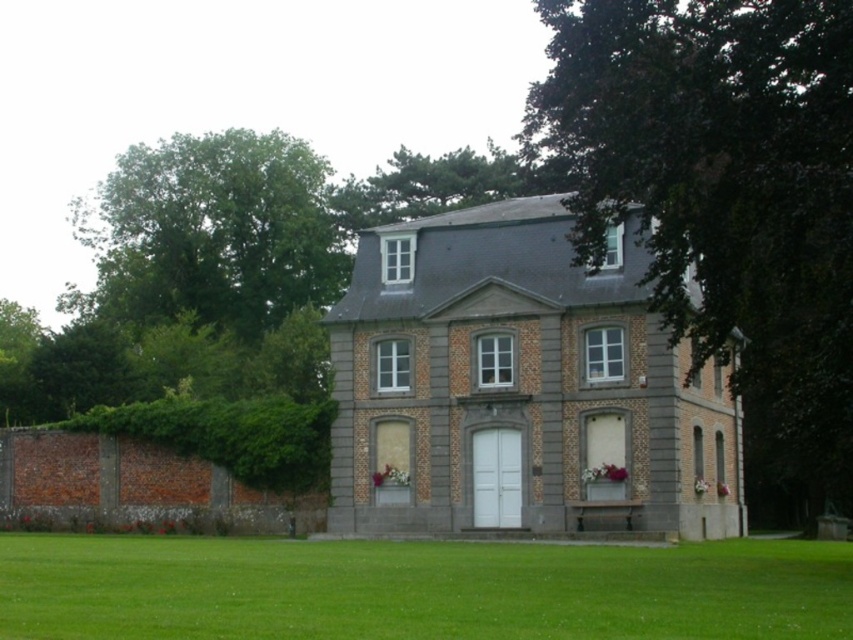
You are a gardener who needs to mow the lawn. You see the green grass at lower center and the green leafy hedge at left. Which one should you mow first based on their heights?

The green grass at lower center should be mowed first since it is shorter than the green leafy hedge at left.